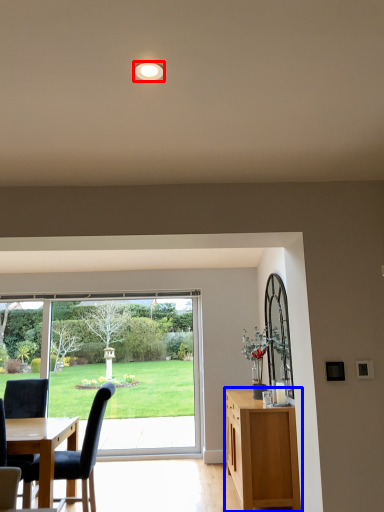
Question: Which point is further to the camera, lighting (highlighted by a red box) or cabinetry (highlighted by a blue box)?

Choices:
 (A) lighting
 (B) cabinetry

Answer: (B)